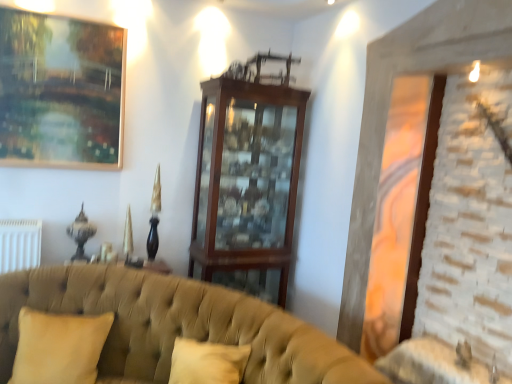
This screenshot has height=384, width=512. What are the coordinates of `vacant space situated above gold-framed painting at upper left (from a real-world perspective)` in the screenshot? It's located at (67, 16).